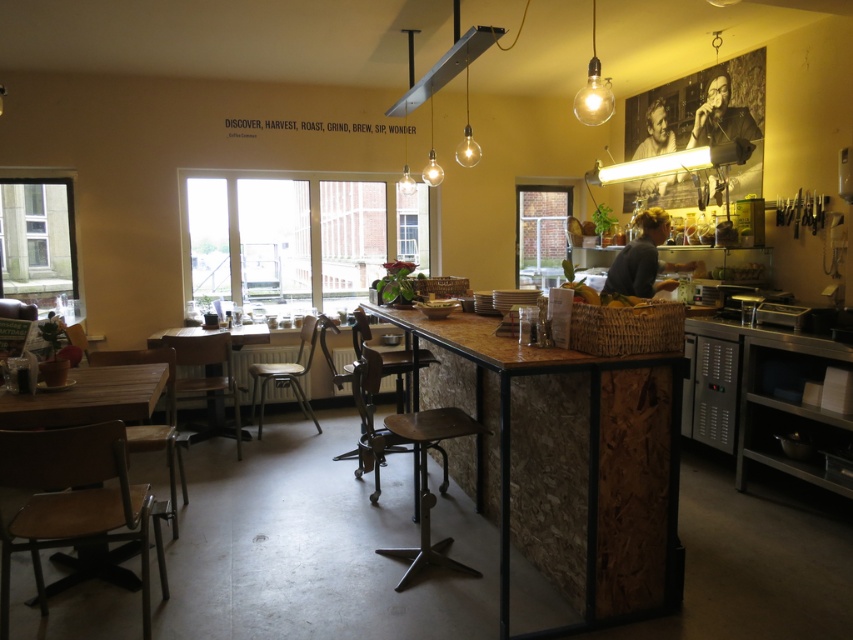
Question: Which object is the farthest from the wooden textured table at center?

Choices:
 (A) wooden seat at lower left
 (B) metallic dark brown chair at center

Answer: (A)

Question: Can you confirm if wooden seat at lower left is positioned above wooden seat at left?

Choices:
 (A) no
 (B) yes

Answer: (A)

Question: Is wooden seat at lower left behind metallic silver chair at center?

Choices:
 (A) no
 (B) yes

Answer: (A)

Question: Among these objects, which one is nearest to the camera?

Choices:
 (A) wooden textured table at center
 (B) metallic silver chair at center

Answer: (A)

Question: Is wooden textured table at center bigger than metallic silver chair at center?

Choices:
 (A) no
 (B) yes

Answer: (B)

Question: Which point is closer to the camera?

Choices:
 (A) wooden seat at left
 (B) metallic dark brown chair at center
 (C) wooden chair at lower left
 (D) wooden textured table at center

Answer: (D)